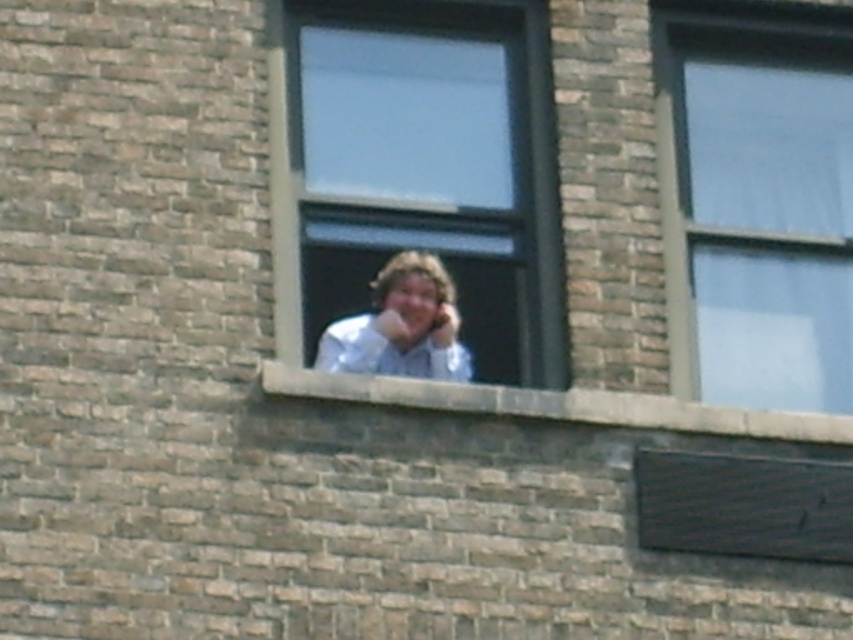
Does transparent glass window at upper right appear on the right side of white shirt at center?

Indeed, transparent glass window at upper right is positioned on the right side of white shirt at center.

Is point (701, 65) farther from camera compared to point (389, 346)?

That is True.

Is point (665, 195) closer to viewer compared to point (372, 291)?

No, (665, 195) is behind (372, 291).

Image resolution: width=853 pixels, height=640 pixels. Find the location of `transparent glass window at upper right`. transparent glass window at upper right is located at coordinates (756, 202).

Is point (308, 120) farther from camera compared to point (821, 442)?

Yes, it is behind point (821, 442).

From the picture: Is clear glass window at center to the left of brown brick ledge at center from the viewer's perspective?

Correct, you'll find clear glass window at center to the left of brown brick ledge at center.

Is point (370, 77) positioned after point (514, 403)?

Yes, point (370, 77) is farther from viewer.

This screenshot has height=640, width=853. What are the coordinates of `clear glass window at center` in the screenshot? It's located at [418, 168].

Can you confirm if transparent glass window at upper right is thinner than brown brick ledge at center?

Yes, transparent glass window at upper right is thinner than brown brick ledge at center.

Is transparent glass window at upper right to the right of brown brick ledge at center from the viewer's perspective?

Yes, transparent glass window at upper right is to the right of brown brick ledge at center.

Is point (805, 224) positioned in front of point (677, 410)?

That is False.

This screenshot has height=640, width=853. In order to click on transparent glass window at upper right in this screenshot , I will do `click(756, 202)`.